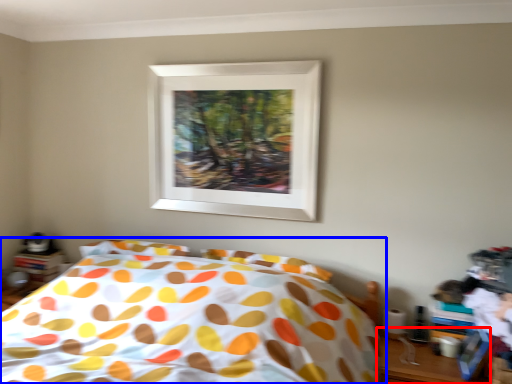
Question: Which object appears farthest to the camera in this image, table (highlighted by a red box) or bed (highlighted by a blue box)?

Choices:
 (A) table
 (B) bed

Answer: (A)